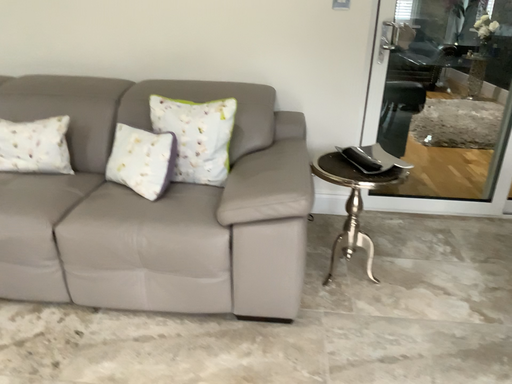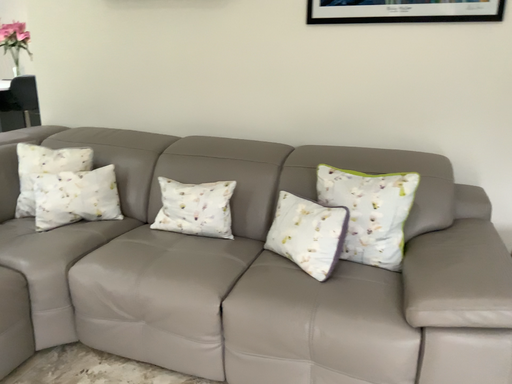
Question: Which way did the camera rotate in the video?

Choices:
 (A) rotated downward
 (B) rotated upward

Answer: (B)